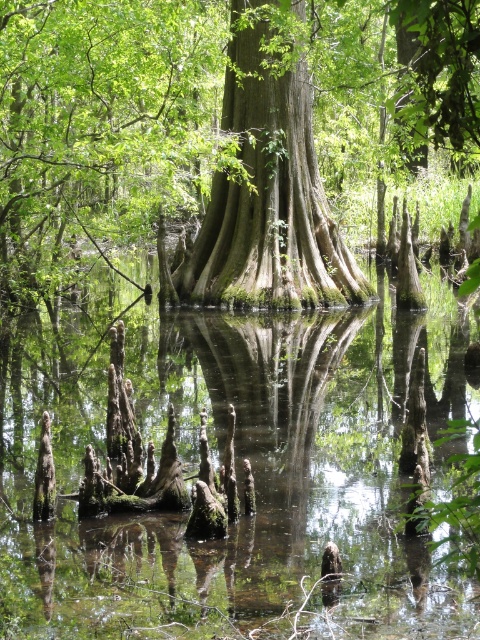
Who is more forward, (271, 397) or (273, 166)?

Positioned in front is point (271, 397).

The width and height of the screenshot is (480, 640). I want to click on green mossy water at center, so click(x=236, y=467).

Does green mossy water at center come in front of green rough bark tree at center?

No, it is not.

Which is in front, point (352, 397) or point (21, 60)?

Point (352, 397)

Does point (428, 332) come in front of point (347, 32)?

Yes.

The width and height of the screenshot is (480, 640). In order to click on green mossy water at center in this screenshot , I will do 236,467.

Between green rough bark tree at center and green mossy tree trunk at center, which one has less height?

green mossy tree trunk at center

Is point (383, 141) positioned behind point (265, 22)?

Yes, it is.

Find the location of a particular element. The image size is (480, 640). green rough bark tree at center is located at coordinates (226, 131).